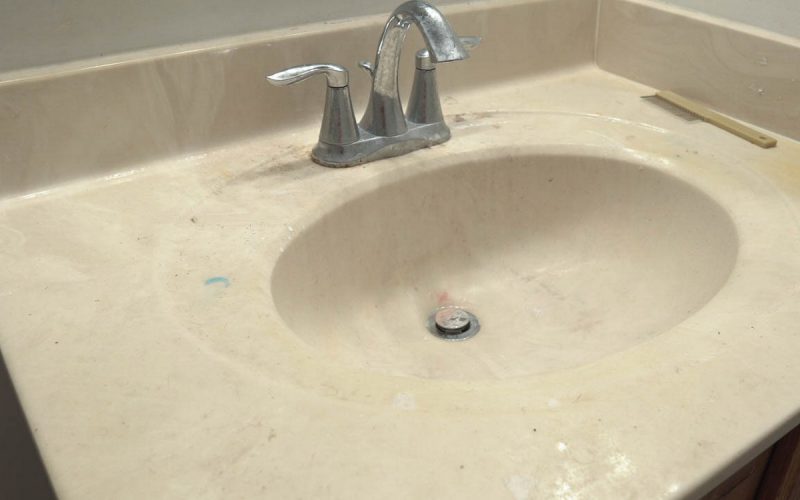
Where is `space to left of counter`? The height and width of the screenshot is (500, 800). space to left of counter is located at coordinates (14, 459).